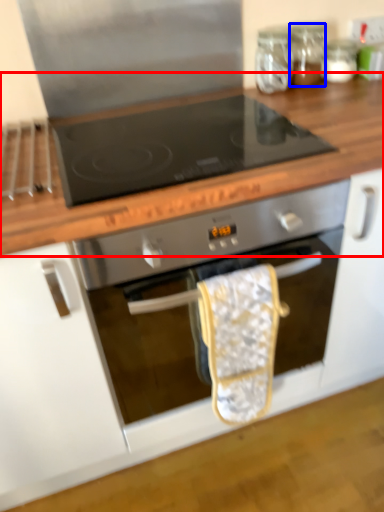
Question: Which of the following is the closest to the observer, countertop (highlighted by a red box) or glass jar (highlighted by a blue box)?

Choices:
 (A) countertop
 (B) glass jar

Answer: (A)